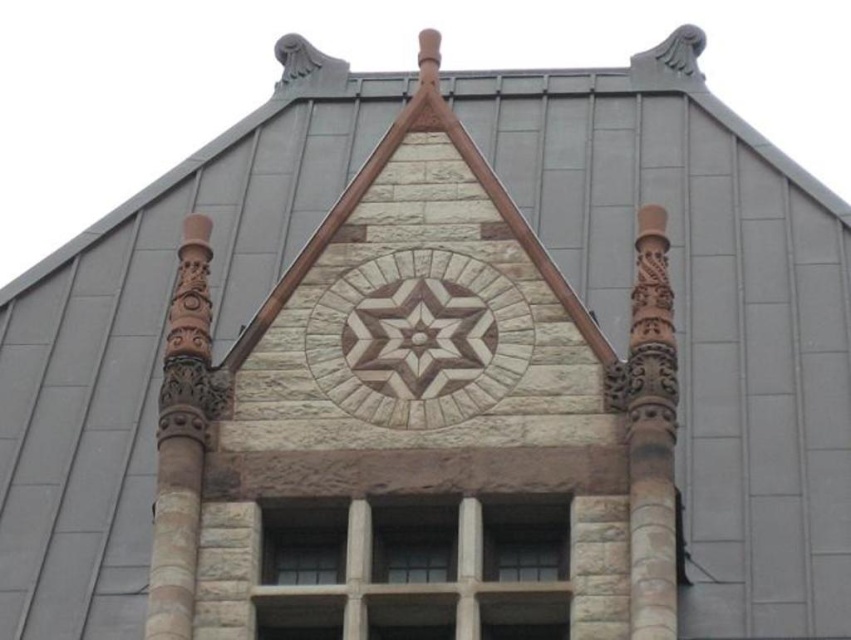
Does brown stone star at center appear on the left side of brown carved pillar at left?

No, brown stone star at center is not to the left of brown carved pillar at left.

Is point (458, 275) positioned after point (170, 490)?

Yes, point (458, 275) is farther from viewer.

Is point (381, 300) positioned after point (193, 406)?

That is True.

This screenshot has width=851, height=640. I want to click on brown stone star at center, so click(x=418, y=339).

Can you confirm if brown stone star at center is shorter than brown carved wood pillar at right?

Yes, brown stone star at center is shorter than brown carved wood pillar at right.

In the scene shown: Does brown stone star at center have a lesser width compared to brown carved wood pillar at right?

No.

Which is behind, point (484, 365) or point (654, 218)?

The point (654, 218) is behind.

This screenshot has height=640, width=851. Find the location of `brown stone star at center`. brown stone star at center is located at coordinates (418, 339).

Where is `brown carved wood pillar at right`? This screenshot has width=851, height=640. brown carved wood pillar at right is located at coordinates (650, 435).

Can you confirm if brown carved wood pillar at right is positioned to the right of brown carved pillar at left?

Indeed, brown carved wood pillar at right is positioned on the right side of brown carved pillar at left.

Does point (637, 394) come in front of point (156, 541)?

No, (637, 394) is further to viewer.

Where is `brown carved wood pillar at right`? This screenshot has width=851, height=640. brown carved wood pillar at right is located at coordinates (650, 435).